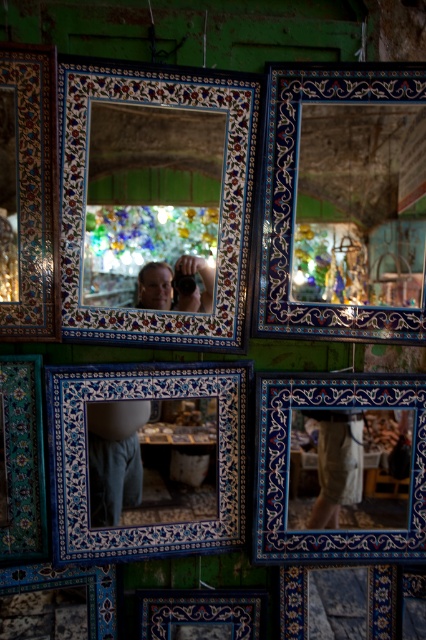
Which is below, matte ceramic mirror at center or matte glass mirror at center?

Positioned lower is matte ceramic mirror at center.

From the picture: Does matte ceramic mirror at center have a lesser height compared to matte glass mirror at center?

No.

Is point (114, 164) positioned after point (154, 115)?

No, (114, 164) is in front of (154, 115).

Where is `matte ceramic mirror at center`? The height and width of the screenshot is (640, 426). matte ceramic mirror at center is located at coordinates (155, 200).

Between matte glass mirror at center and matte blue tile at bottom center, which one is positioned lower?

matte blue tile at bottom center

Between matte glass mirror at center and matte blue tile at bottom center, which one appears on the left side from the viewer's perspective?

matte glass mirror at center

Who is more forward, (181, 232) or (146, 637)?

Point (181, 232)

What are the coordinates of `matte glass mirror at center` in the screenshot? It's located at (152, 205).

The width and height of the screenshot is (426, 640). Describe the element at coordinates (146, 417) in the screenshot. I see `blue ceramic mirror at center` at that location.

Which is above, blue ceramic mirror at center or blue ceramic tile picture frame at left?

blue ceramic tile picture frame at left

Describe the element at coordinates (146, 417) in the screenshot. Image resolution: width=426 pixels, height=640 pixels. I see `blue ceramic mirror at center` at that location.

Locate an element on the screen. The image size is (426, 640). blue ceramic mirror at center is located at coordinates (146, 417).